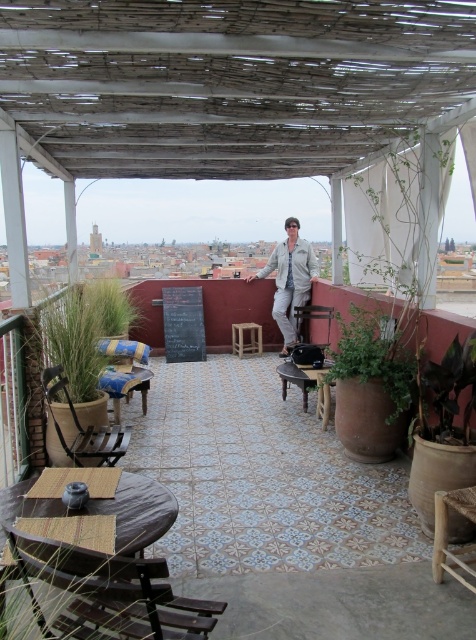
You are standing at the entrance of the rooftop terrace and want to sit down. There is a woven wood chair at lower right. Can you walk directly to it without crossing any obstacles?

Yes, you can walk directly to the woven wood chair at lower right without crossing any obstacles since it is located at point (446, 532), which is near the edge of the terrace and away from the central and left tables and chairs.